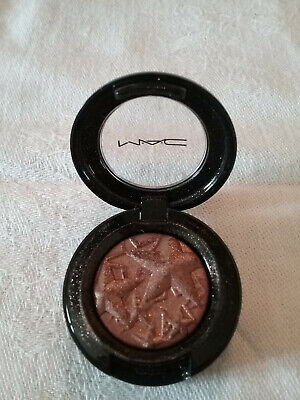
Where is `linen cloth`? This screenshot has height=400, width=300. linen cloth is located at coordinates pos(31,196).